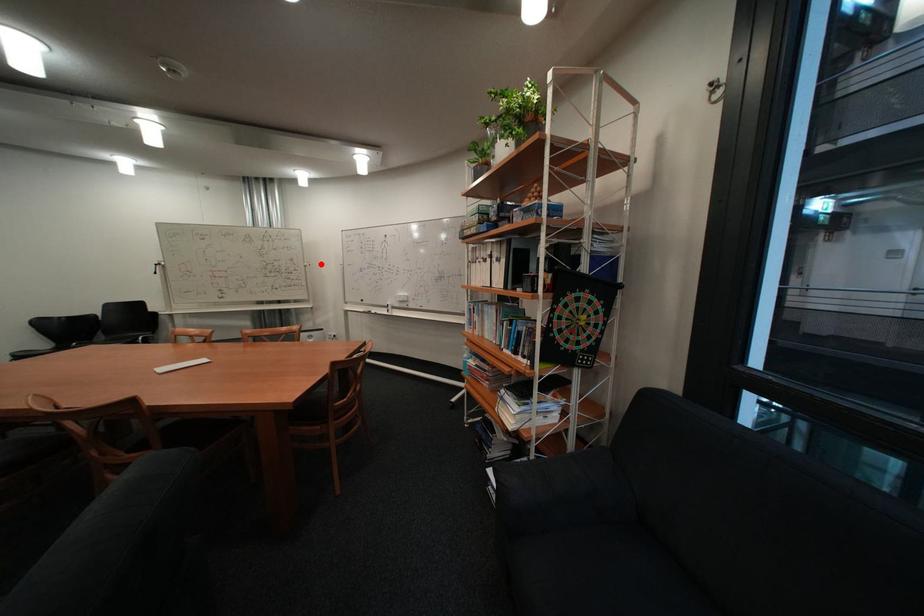
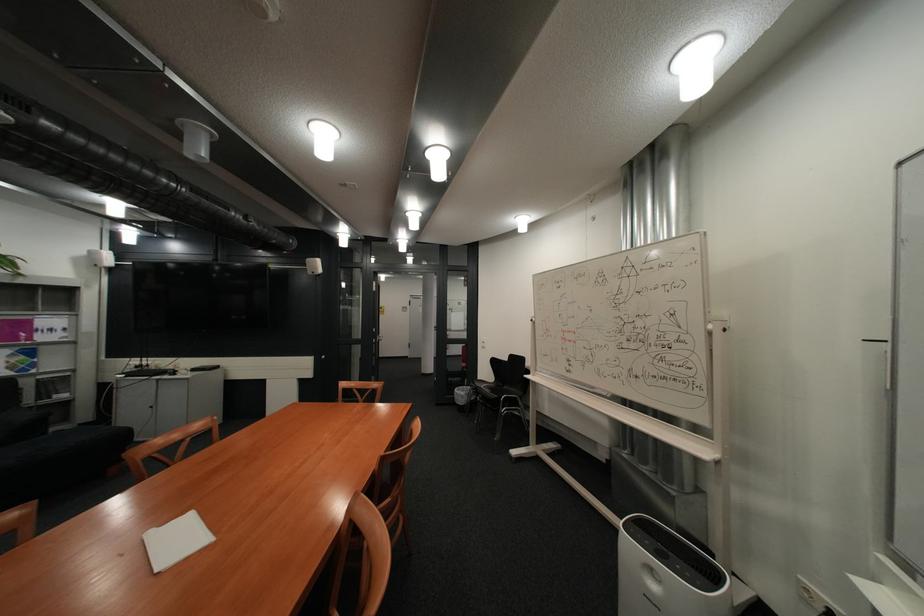
Question: I am providing you with two images of the same scene from different viewpoints. Image1 has a red point marked. In image2, the corresponding 3D location appears at what relative position? Reply with the corresponding letter.

Choices:
 (A) Closer
 (B) Farther

Answer: (B)